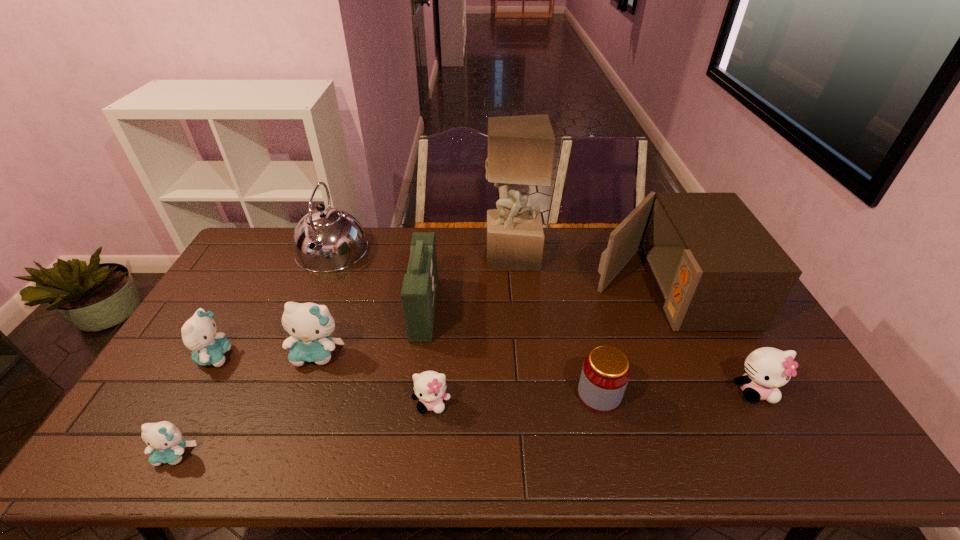
In the image, there is a desktop. At what (x,y) coordinates should I click in order to perform the action: click on vacant space at the right edge. Please return your answer as a coordinate pair (x, y). This screenshot has height=540, width=960. Looking at the image, I should click on (782, 394).

The height and width of the screenshot is (540, 960). In the image, there is a desktop. Find the location of `blank space at the far left corner`. blank space at the far left corner is located at coordinates (281, 249).

Locate an element on the screen. This screenshot has height=540, width=960. free space between the right white kitten and the microwave oven is located at coordinates (708, 338).

The width and height of the screenshot is (960, 540). Identify the location of vacant area that lies between the gray sculpture and the bigger white kitten. (633, 322).

Locate an element on the screen. This screenshot has height=540, width=960. free space that is in between the left white kitten and the microwave oven is located at coordinates (547, 345).

This screenshot has width=960, height=540. Find the location of `free space between the brown microwave oven and the nearest kitten`. free space between the brown microwave oven and the nearest kitten is located at coordinates (420, 370).

Locate an element on the screen. The height and width of the screenshot is (540, 960). vacant area that lies between the eighth object from left to right and the kettle is located at coordinates (465, 323).

Identify the location of free space between the kettle and the second biggest blue kitten. (273, 305).

The height and width of the screenshot is (540, 960). What are the coordinates of `free area in between the eighth object from left to right and the nearest object` in the screenshot? It's located at (387, 424).

Locate an element on the screen. vacant area that lies between the jar and the sculpture is located at coordinates (555, 325).